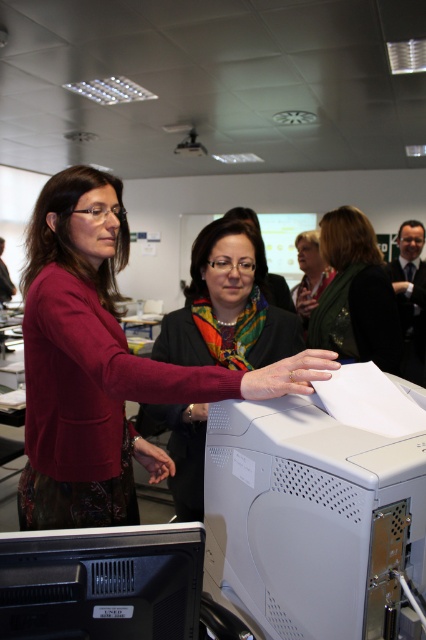
Does white plastic printer at center have a lesser width compared to green textured scarf at center?

No.

From the picture: Can you confirm if white plastic printer at center is positioned below green textured scarf at center?

Yes.

This screenshot has width=426, height=640. What are the coordinates of `white plastic printer at center` in the screenshot? It's located at (310, 518).

This screenshot has width=426, height=640. I want to click on white plastic printer at center, so click(x=310, y=518).

Consider the image. Does white plastic printer at center have a greater width compared to matte black sweater at center?

No.

Who is taller, white plastic printer at center or matte black sweater at center?

With more height is matte black sweater at center.

At what (x,y) coordinates should I click in order to perform the action: click on white plastic printer at center. Please return your answer as a coordinate pair (x, y). Image resolution: width=426 pixels, height=640 pixels. Looking at the image, I should click on (310, 518).

The width and height of the screenshot is (426, 640). I want to click on white plastic printer at center, so click(x=310, y=518).

Which is more to the left, black plastic computer monitor at lower left or green textured scarf at center?

black plastic computer monitor at lower left is more to the left.

In the scene shown: Measure the distance between black plastic computer monitor at lower left and camera.

black plastic computer monitor at lower left is 25.00 inches from camera.

Identify the location of black plastic computer monitor at lower left. (101, 582).